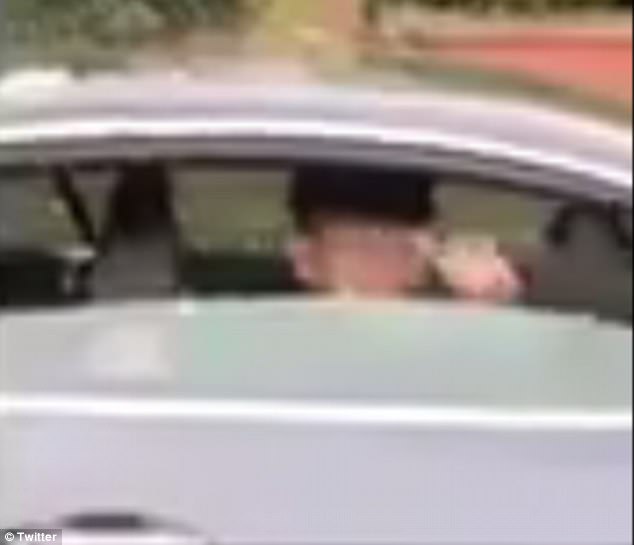
The width and height of the screenshot is (634, 545). In order to click on window in this screenshot , I will do `click(16, 227)`, `click(224, 202)`, `click(474, 208)`, `click(358, 347)`.